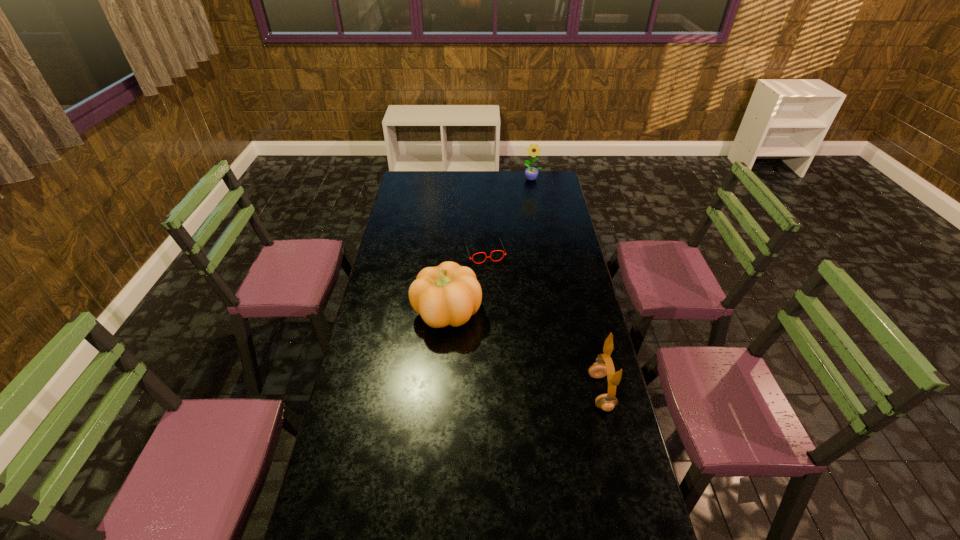
I want to click on free space on the desktop that is between the second nearest object and the rightmost object and is positioned on the front-facing side of the shortest object, so click(x=516, y=348).

Where is `vacant space on the desktop that is between the pumpkin and the nearest object and is positioned on the front-facing side of the farthest object`? The image size is (960, 540). vacant space on the desktop that is between the pumpkin and the nearest object and is positioned on the front-facing side of the farthest object is located at coordinates (511, 345).